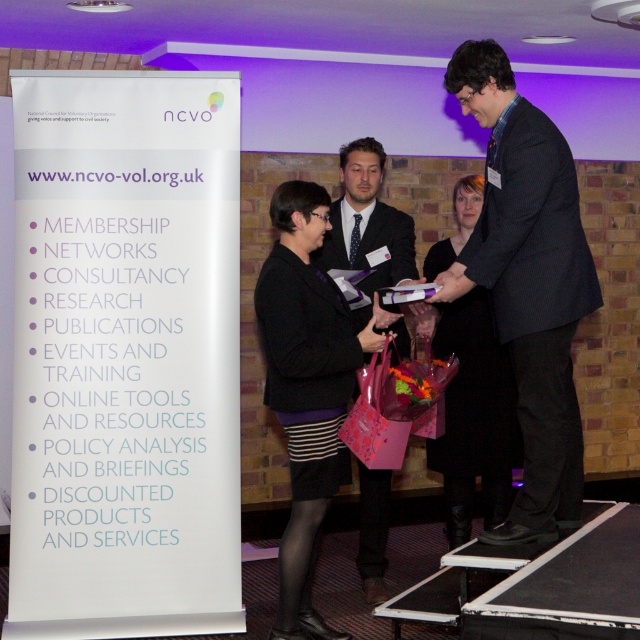
Question: Can you confirm if black textured skirt at center is positioned to the right of black fabric dress at center?

Choices:
 (A) yes
 (B) no

Answer: (B)

Question: Can you confirm if black textured suit at center is positioned above matte black suit at center?

Choices:
 (A) no
 (B) yes

Answer: (A)

Question: Can you confirm if black textured skirt at center is positioned below matte black suit at center?

Choices:
 (A) no
 (B) yes

Answer: (B)

Question: Which point is closer to the camera?

Choices:
 (A) (544, 499)
 (B) (312, 458)

Answer: (A)

Question: Which object appears farthest from the camera in this image?

Choices:
 (A) matte black suit at center
 (B) black textured skirt at center
 (C) black textured suit at center

Answer: (A)

Question: Which is nearer to the black textured skirt at center?

Choices:
 (A) black textured suit at center
 (B) matte black suit at center
 (C) black fabric dress at center

Answer: (B)